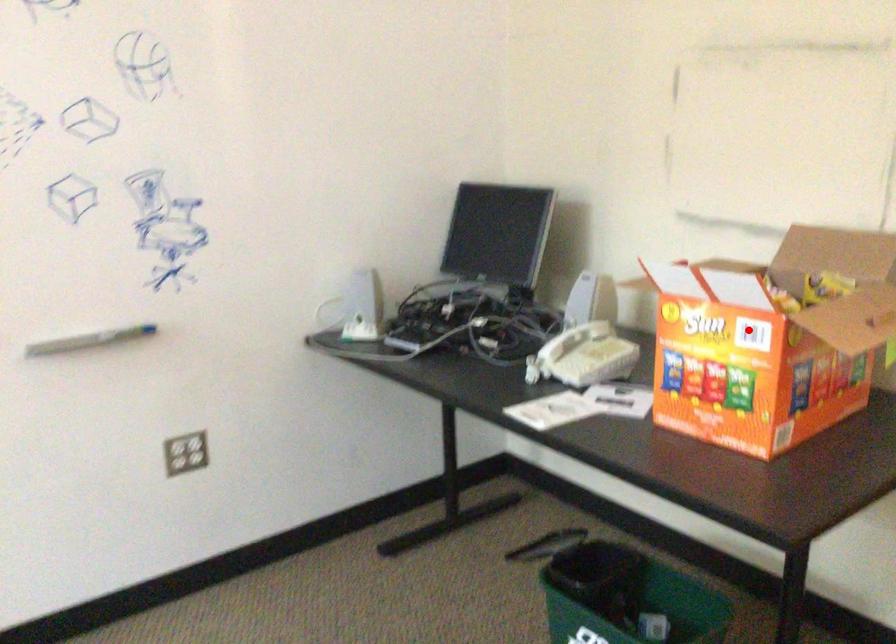
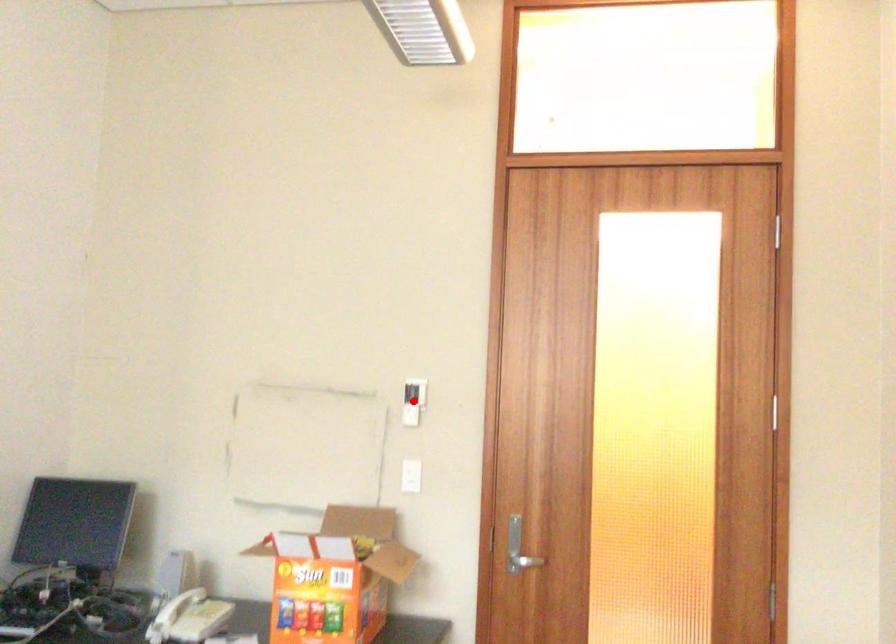
Looking at this image, I am providing you with two images of the same scene from different viewpoints. A red point is marked on the first image and another point is marked on the second image. Are the points marked in image1 and image2 representing the same 3D position?

No